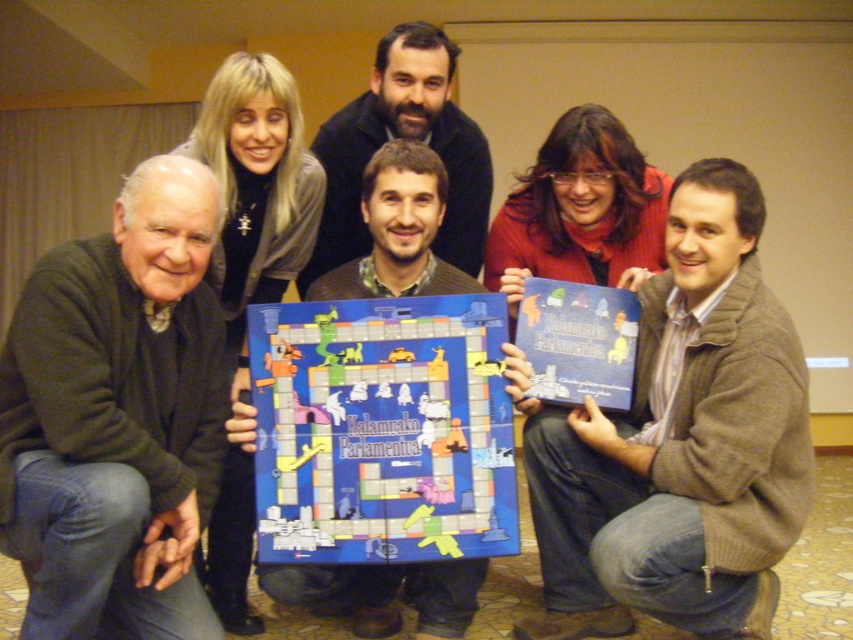
Who is lower down, brown sweater at center or brown textured sweater at center?

Positioned lower is brown textured sweater at center.

Does brown sweater at center appear over brown textured sweater at center?

Yes, brown sweater at center is above brown textured sweater at center.

Where is `brown sweater at center`? Image resolution: width=853 pixels, height=640 pixels. brown sweater at center is located at coordinates (677, 442).

I want to click on brown sweater at center, so click(x=677, y=442).

Who is taller, dark green sweater at lower left or bearded man at center?

dark green sweater at lower left is taller.

Is dark green sweater at lower left further to camera compared to bearded man at center?

No.

Locate an element on the screen. dark green sweater at lower left is located at coordinates (117, 417).

This screenshot has width=853, height=640. I want to click on dark green sweater at lower left, so click(x=117, y=417).

In the scene shown: Who is shorter, brown sweater at center or dark green sweater at lower left?

dark green sweater at lower left is shorter.

Can you confirm if brown sweater at center is thinner than dark green sweater at lower left?

No.

Who is more forward, [648,522] or [180,224]?

Point [180,224] is in front.

Find the location of a particular element. brown sweater at center is located at coordinates (677, 442).